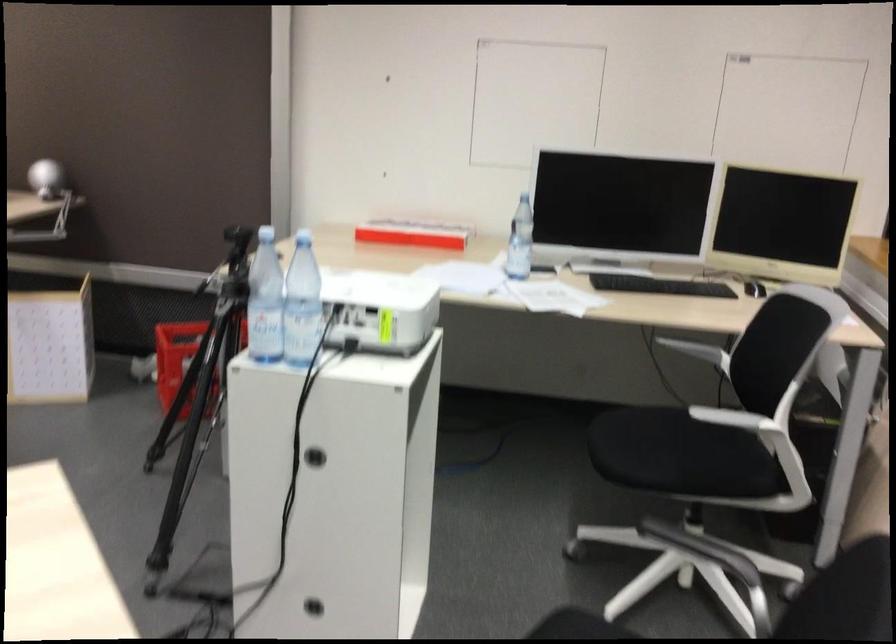
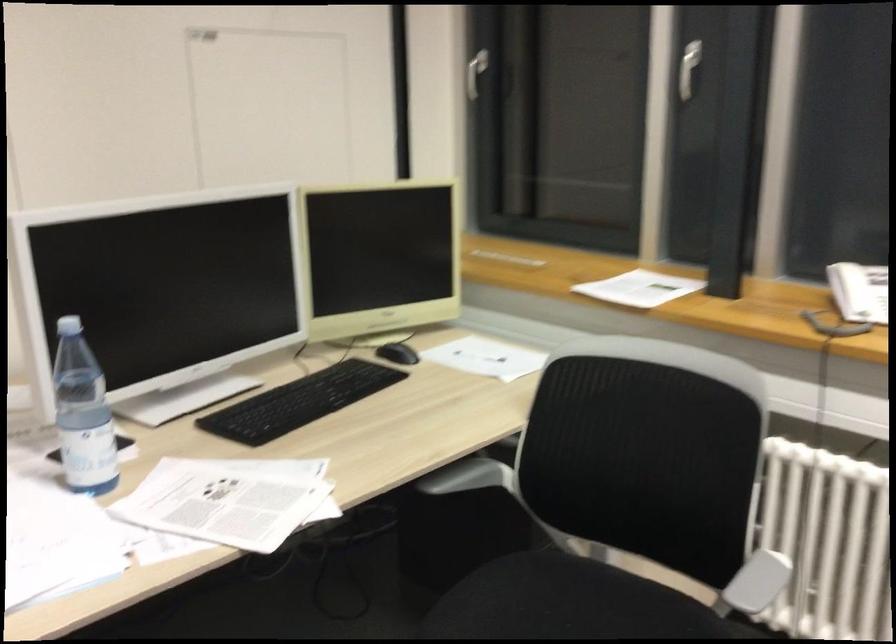
In the second image, find the point that corresponds to point (755, 281) in the first image.

(398, 353)